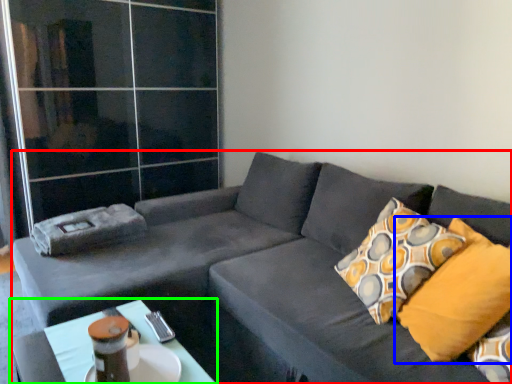
Question: Based on their relative distances, which object is nearer to studio couch (highlighted by a red box)? Choose from pillow (highlighted by a blue box) and table (highlighted by a green box).

Choices:
 (A) pillow
 (B) table

Answer: (A)